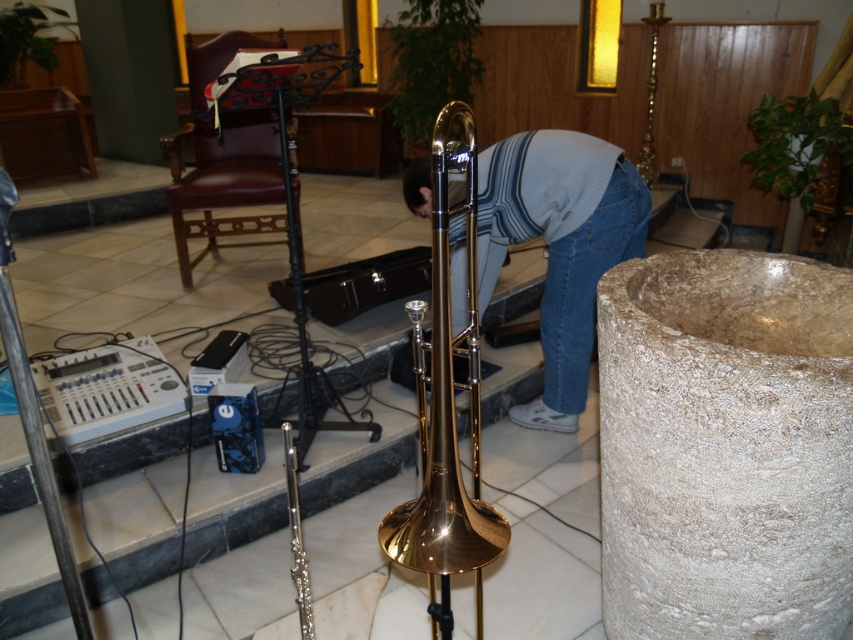
Which of these two, striped sweater at center or gold polished trombone at center, stands taller?

With more height is gold polished trombone at center.

Is striped sweater at center shorter than gold polished trombone at center?

Indeed, striped sweater at center has a lesser height compared to gold polished trombone at center.

This screenshot has height=640, width=853. Describe the element at coordinates (560, 244) in the screenshot. I see `striped sweater at center` at that location.

Identify the location of striped sweater at center. (560, 244).